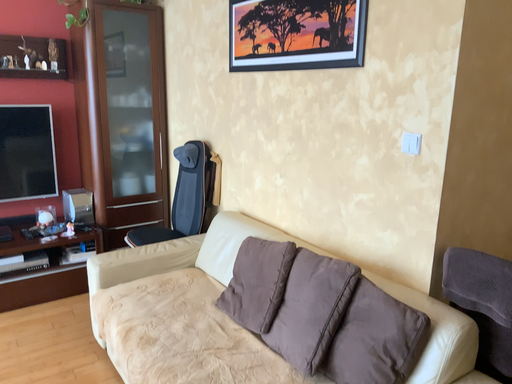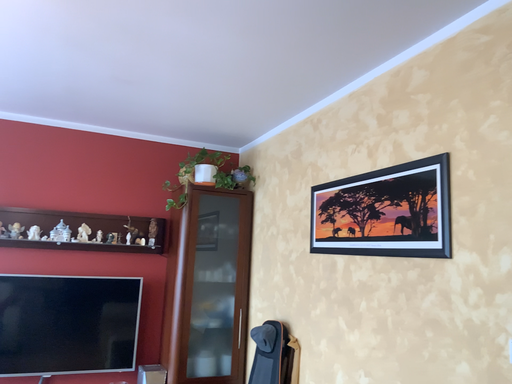
Question: How did the camera likely rotate when shooting the video?

Choices:
 (A) rotated upward
 (B) rotated downward

Answer: (A)